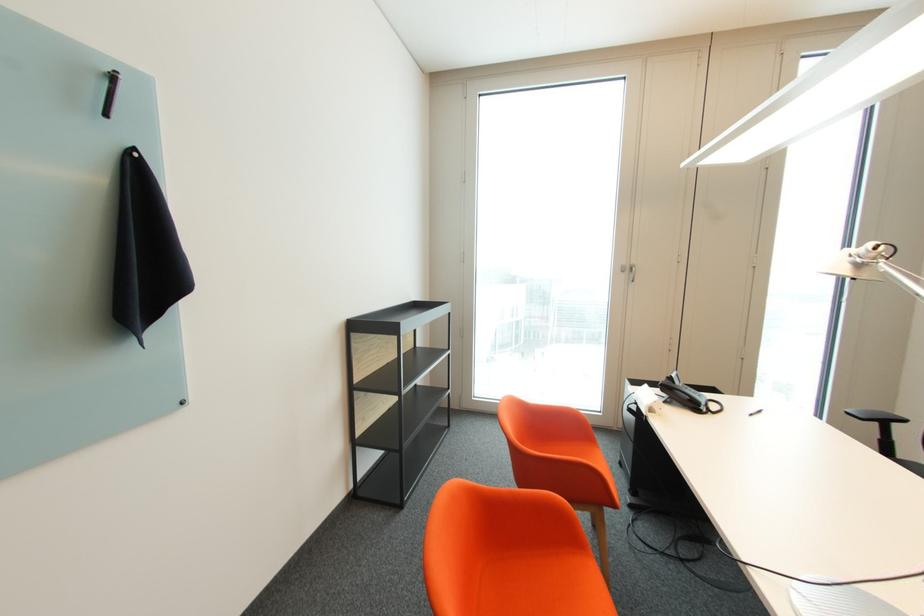
Image resolution: width=924 pixels, height=616 pixels. Identify the location of cabinet door handle. (631, 272).